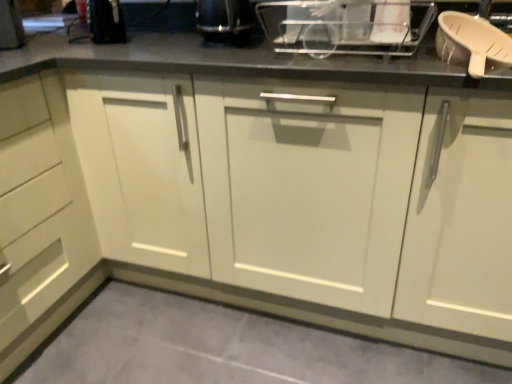
Question: Which direction should I rotate to look at white plastic dish rack at upper center, the second appliance viewed from the left, — up or down?

Choices:
 (A) down
 (B) up

Answer: (B)

Question: Could you tell me if black plastic kettle at upper center, acting as the 1th appliance starting from the left, is facing white plastic dish rack at upper center, the second appliance viewed from the left?

Choices:
 (A) no
 (B) yes

Answer: (A)

Question: Is white plastic dish rack at upper center, the second appliance viewed from the left, located within black plastic kettle at upper center, which appears as the 2th appliance when viewed from the right?

Choices:
 (A) no
 (B) yes

Answer: (A)

Question: Considering the relative sizes of black plastic kettle at upper center, acting as the 1th appliance starting from the left, and white plastic dish rack at upper center, which appears as the first appliance when viewed from the right, in the image provided, is black plastic kettle at upper center, acting as the 1th appliance starting from the left, bigger than white plastic dish rack at upper center, which appears as the first appliance when viewed from the right,?

Choices:
 (A) no
 (B) yes

Answer: (B)

Question: Is the depth of black plastic kettle at upper center, which appears as the 2th appliance when viewed from the right, greater than that of white plastic dish rack at upper center, which appears as the first appliance when viewed from the right?

Choices:
 (A) yes
 (B) no

Answer: (A)

Question: Is black plastic kettle at upper center, which appears as the 2th appliance when viewed from the right, outside white plastic dish rack at upper center, the second appliance viewed from the left?

Choices:
 (A) yes
 (B) no

Answer: (A)

Question: Does black plastic kettle at upper center, which appears as the 2th appliance when viewed from the right, have a lesser height compared to white plastic dish rack at upper center, which appears as the first appliance when viewed from the right?

Choices:
 (A) yes
 (B) no

Answer: (A)

Question: From a real-world perspective, does white plastic dish rack at upper center, the second appliance viewed from the left, stand above gray tile floor at lower center?

Choices:
 (A) no
 (B) yes

Answer: (B)

Question: Is white plastic dish rack at upper center, which appears as the first appliance when viewed from the right, not inside gray tile floor at lower center?

Choices:
 (A) no
 (B) yes

Answer: (B)

Question: From the image's perspective, is white plastic dish rack at upper center, which appears as the first appliance when viewed from the right, beneath gray tile floor at lower center?

Choices:
 (A) yes
 (B) no

Answer: (B)

Question: Is white plastic dish rack at upper center, which appears as the first appliance when viewed from the right, beside gray tile floor at lower center?

Choices:
 (A) yes
 (B) no

Answer: (B)

Question: Is white plastic dish rack at upper center, the second appliance viewed from the left, looking in the opposite direction of gray tile floor at lower center?

Choices:
 (A) yes
 (B) no

Answer: (B)

Question: From the image's perspective, is white plastic dish rack at upper center, the second appliance viewed from the left, over gray tile floor at lower center?

Choices:
 (A) yes
 (B) no

Answer: (A)

Question: Does black plastic kettle at upper center, which appears as the 2th appliance when viewed from the right, have a greater width compared to gray tile floor at lower center?

Choices:
 (A) yes
 (B) no

Answer: (B)